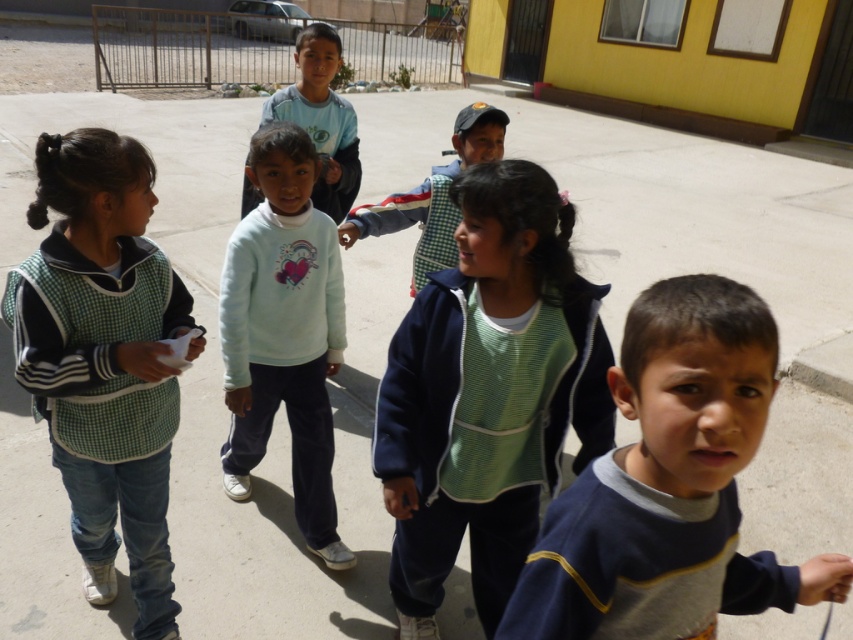
Question: Does light blue fleece sweater at center have a larger size compared to green textured sweater at center?

Choices:
 (A) no
 (B) yes

Answer: (B)

Question: Which point is closer to the camera taking this photo?

Choices:
 (A) (440, 534)
 (B) (312, 24)
 (C) (315, 218)

Answer: (A)

Question: Among these points, which one is nearest to the camera?

Choices:
 (A) (704, 358)
 (B) (404, 532)

Answer: (A)

Question: Is blue fleece sweater at center in front of green checkered vest at left?

Choices:
 (A) yes
 (B) no

Answer: (A)

Question: Estimate the real-world distances between objects in this image. Which object is closer to the green checkered vest at left?

Choices:
 (A) light blue fleece sweater at center
 (B) matte blue shirt at center
 (C) green textured sweater at center
 (D) blue fleece sweater at center

Answer: (A)

Question: Does green knit sweater at center have a smaller size compared to green checkered vest at left?

Choices:
 (A) no
 (B) yes

Answer: (B)